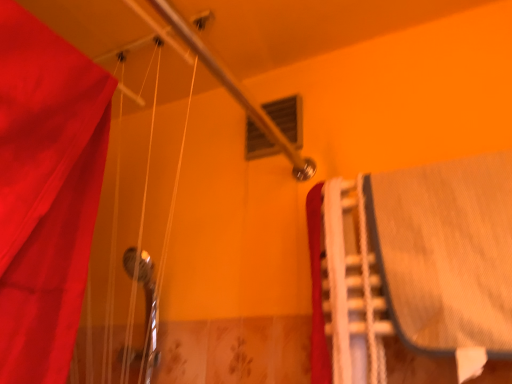
Question: From a real-world perspective, is denim bed at right physically located above or below matte plastic window at upper center?

Choices:
 (A) below
 (B) above

Answer: (A)

Question: Considering the positions of denim bed at right and matte plastic window at upper center in the image, is denim bed at right bigger or smaller than matte plastic window at upper center?

Choices:
 (A) small
 (B) big

Answer: (B)

Question: Which of these objects is positioned closest to the denim bed at right?

Choices:
 (A) matte plastic window at upper center
 (B) white plastic stairs at right

Answer: (B)

Question: Which object is positioned farthest from the white plastic stairs at right?

Choices:
 (A) denim bed at right
 (B) matte plastic window at upper center

Answer: (B)